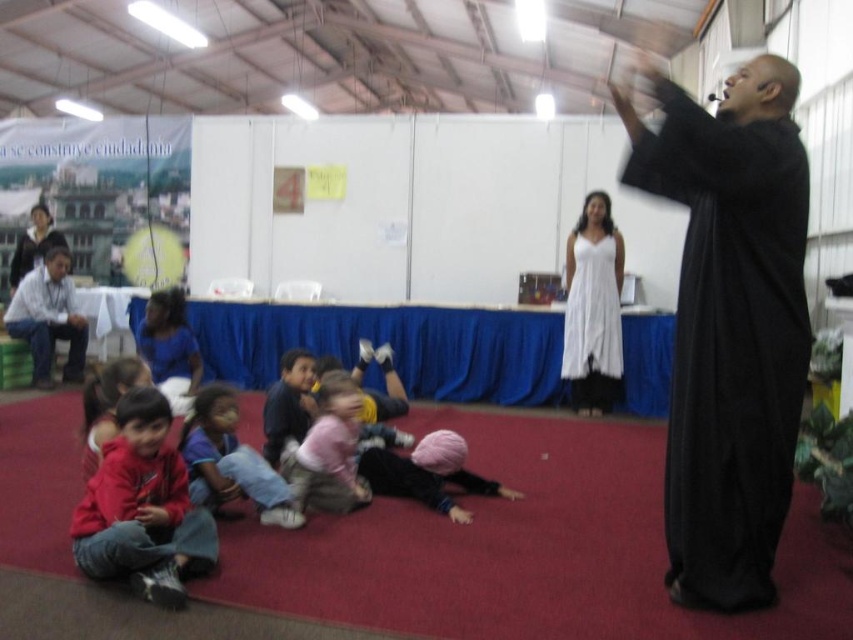
Does red fleece jacket at lower left have a greater height compared to pink fabric at center?

Yes.

Who is taller, red fleece jacket at lower left or pink fabric at center?

red fleece jacket at lower left

Does point (195, 518) come farther from viewer compared to point (317, 508)?

No, (195, 518) is in front of (317, 508).

This screenshot has height=640, width=853. Find the location of `red fleece jacket at lower left`. red fleece jacket at lower left is located at coordinates (142, 508).

Between black matte robe at right and white lace dress at center, which one appears on the left side from the viewer's perspective?

black matte robe at right

Is black matte robe at right to the right of white lace dress at center from the viewer's perspective?

In fact, black matte robe at right is to the left of white lace dress at center.

Find the location of a particular element. The width and height of the screenshot is (853, 640). black matte robe at right is located at coordinates (729, 339).

Which is more to the right, red fleece jacket at lower left or white lace dress at center?

Positioned to the right is white lace dress at center.

Can you confirm if red fleece jacket at lower left is taller than white lace dress at center?

No, red fleece jacket at lower left is not taller than white lace dress at center.

Between point (119, 451) and point (585, 314), which one is positioned behind?

The point (585, 314) is behind.

Image resolution: width=853 pixels, height=640 pixels. In order to click on red fleece jacket at lower left in this screenshot , I will do `click(142, 508)`.